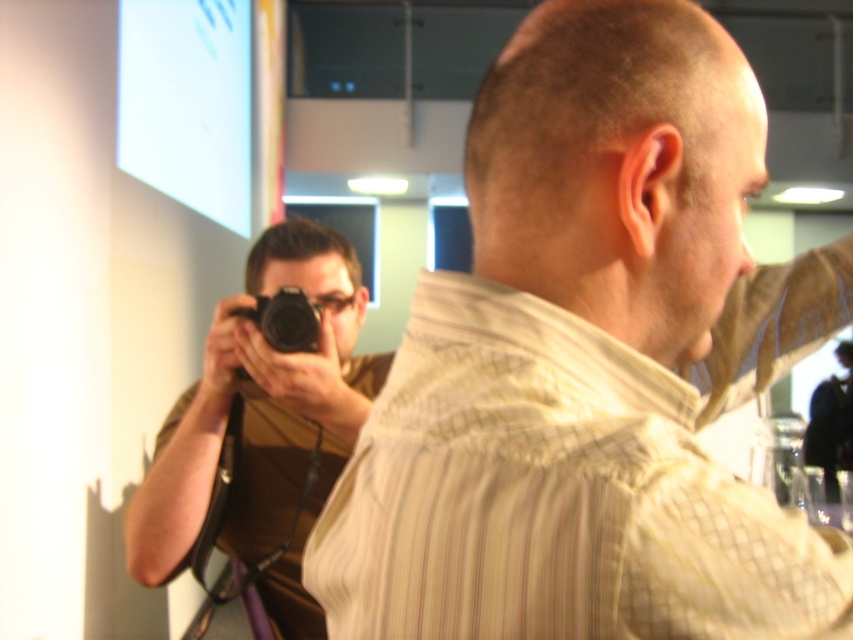
Is point (427, 388) closer to viewer compared to point (277, 342)?

Yes, point (427, 388) is in front of point (277, 342).

Between light beige striped shirt at center and black plastic camera at center, which one is positioned higher?

Positioned higher is light beige striped shirt at center.

What do you see at coordinates (590, 365) in the screenshot? I see `light beige striped shirt at center` at bounding box center [590, 365].

You are a GUI agent. You are given a task and a screenshot of the screen. Output one action in this format:
    pyautogui.click(x=<x>, y=<y>)
    Task: Click on the light beige striped shirt at center
    The image size is (853, 640).
    Given the screenshot: What is the action you would take?
    pyautogui.click(x=590, y=365)

Is point (515, 106) in front of point (206, 356)?

Yes, point (515, 106) is closer to viewer.

Which is more to the right, light beige striped shirt at center or black matte camera at center?

light beige striped shirt at center

Is point (646, 518) positioned before point (160, 540)?

Yes, point (646, 518) is in front of point (160, 540).

At what (x,y) coordinates should I click in order to perform the action: click on light beige striped shirt at center. Please return your answer as a coordinate pair (x, y). The height and width of the screenshot is (640, 853). Looking at the image, I should click on (590, 365).

Can you confirm if black matte camera at center is taller than black plastic camera at center?

Yes, black matte camera at center is taller than black plastic camera at center.

Does black matte camera at center have a smaller size compared to black plastic camera at center?

Incorrect, black matte camera at center is not smaller in size than black plastic camera at center.

Find the location of `black matte camera at center`. black matte camera at center is located at coordinates (262, 426).

The image size is (853, 640). What are the coordinates of `black matte camera at center` in the screenshot? It's located at (262, 426).